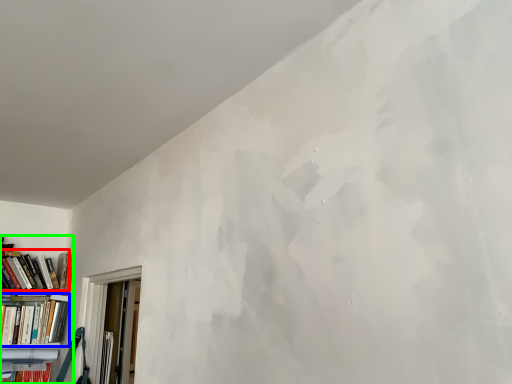
Question: Estimate the real-world distances between objects in this image. Which object is farther from book (highlighted by a red box), book (highlighted by a blue box) or bookcase (highlighted by a green box)?

Choices:
 (A) book
 (B) bookcase

Answer: (A)